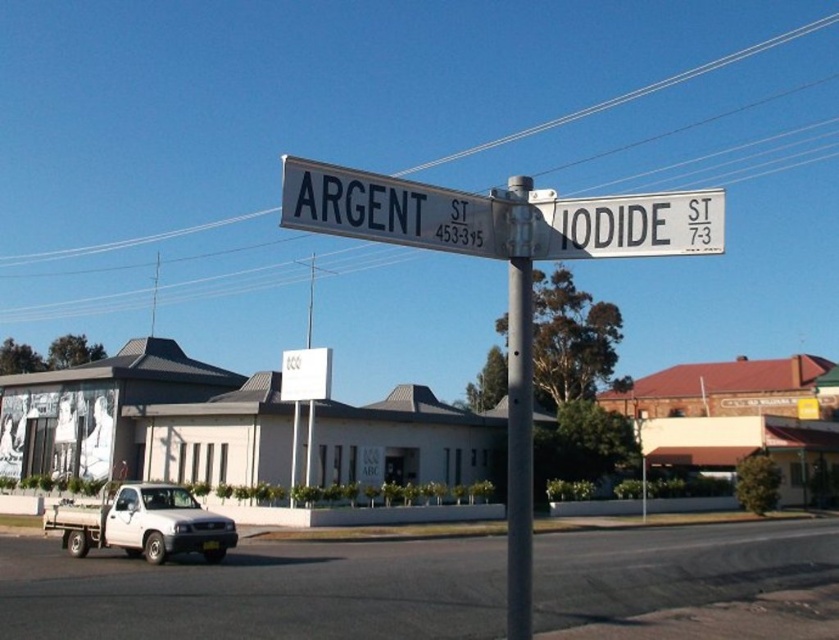
Question: Is white concrete building at center closer to camera compared to white matte truck at lower left?

Choices:
 (A) no
 (B) yes

Answer: (A)

Question: Can you confirm if white concrete building at center is thinner than gray metallic pole at center?

Choices:
 (A) no
 (B) yes

Answer: (A)

Question: Where is white concrete building at center located in relation to gray metallic pole at center in the image?

Choices:
 (A) left
 (B) right

Answer: (B)

Question: Which point is closer to the camera?

Choices:
 (A) (639, 586)
 (B) (697, 464)
 (C) (462, 243)

Answer: (C)

Question: Which point is closer to the camera taking this photo?

Choices:
 (A) (102, 513)
 (B) (516, 268)
 (C) (441, 192)
 (D) (657, 557)

Answer: (C)

Question: Which object is closer to the camera taking this photo?

Choices:
 (A) white matte truck at lower left
 (B) white plastic truck at lower left
 (C) white concrete building at center

Answer: (B)